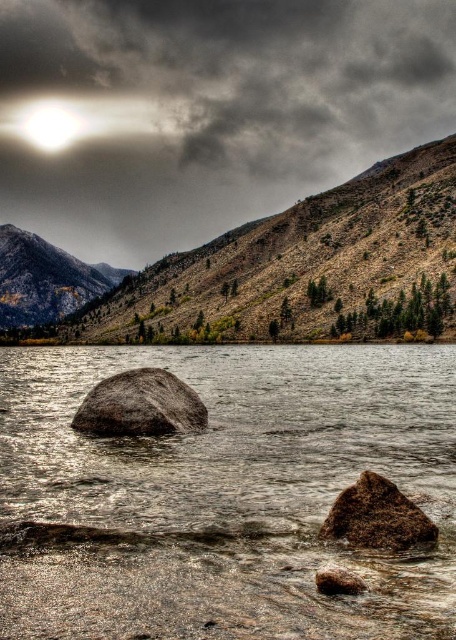
You are an astronomer observing the sky in the image. You notice the dark gray cloud at upper center and the bright white light at upper left. Which object is wider?

The dark gray cloud at upper center is wider than the bright white light at upper left according to the description.

You are standing at the lakeside and want to reach the point marked at coordinates point (185, 64). If you can walk at a speed of 1.5 meters per second, how many minutes will it take you to reach that point?

The distance to point (185, 64) is 758.91 meters. At a walking speed of 1.5 meters per second, it would take 758.91 divided by 1.5 equals approximately 505.94 seconds. Converting seconds to minutes by dividing by 60 gives roughly 8.43 minutes. Therefore, it will take approximately 8.43 minutes to reach point (185, 64).